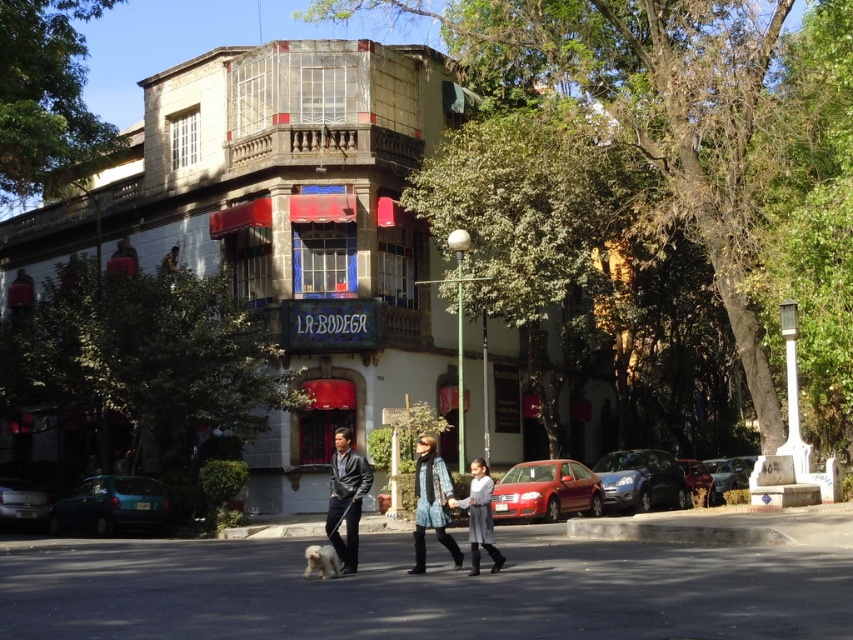
Question: Which object appears closest to the camera in this image?

Choices:
 (A) gray wool coat at center
 (B) metallic silver car at center

Answer: (A)

Question: Among these points, which one is nearest to the camera?

Choices:
 (A) [x=692, y=492]
 (B) [x=480, y=484]

Answer: (B)

Question: Does gray wool coat at center come in front of metallic silver car at lower right?

Choices:
 (A) yes
 (B) no

Answer: (A)

Question: Can you confirm if gray wool coat at center is thinner than metallic silver car at lower right?

Choices:
 (A) no
 (B) yes

Answer: (B)

Question: Among these points, which one is nearest to the camera?

Choices:
 (A) (473, 508)
 (B) (555, 490)

Answer: (A)

Question: Does shiny silver sedan at center have a larger size compared to white fur dog at lower center?

Choices:
 (A) no
 (B) yes

Answer: (B)